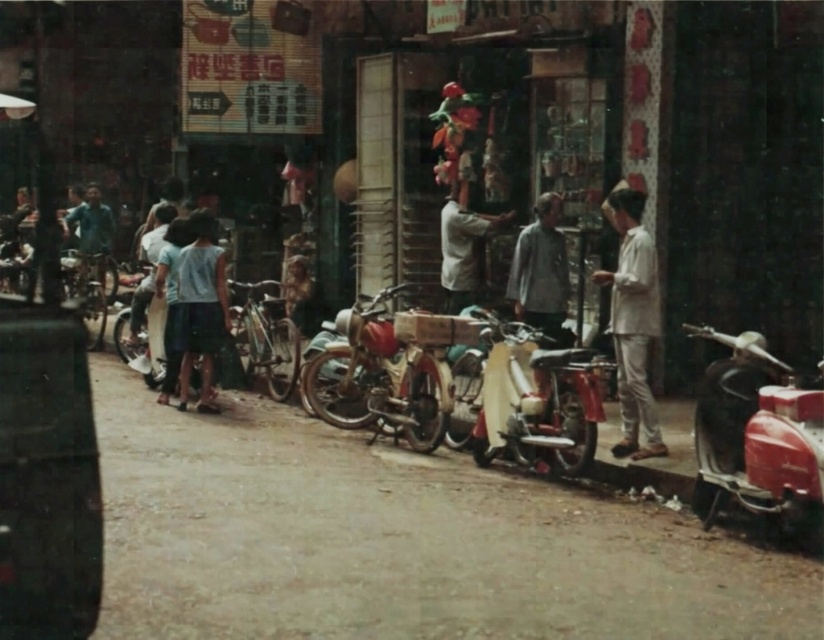
Question: Where is light blue fabric skirt at center located in relation to light brown fabric shirt at center in the image?

Choices:
 (A) below
 (B) above

Answer: (A)

Question: Which of the following is the closest to the observer?

Choices:
 (A) dark blue shirt at left
 (B) white cotton shirt at right
 (C) shiny red scooter at right
 (D) gray cotton shirt at center

Answer: (C)

Question: Which point appears farthest from the camera in this image?

Choices:
 (A) (696, 474)
 (B) (570, 387)
 (C) (624, 298)

Answer: (C)

Question: Does shiny red motorcycle at center have a lesser width compared to dark blue shirt at left?

Choices:
 (A) yes
 (B) no

Answer: (A)

Question: Is gray cotton shirt at center further to camera compared to shiny metallic bicycle at center-left?

Choices:
 (A) yes
 (B) no

Answer: (B)

Question: Estimate the real-world distances between objects in this image. Which object is farther from the shiny red motorcycle at center?

Choices:
 (A) light blue fabric skirt at center
 (B) shiny chrome motorcycle at center
 (C) shiny red scooter at right
 (D) white cotton shirt at right

Answer: (A)